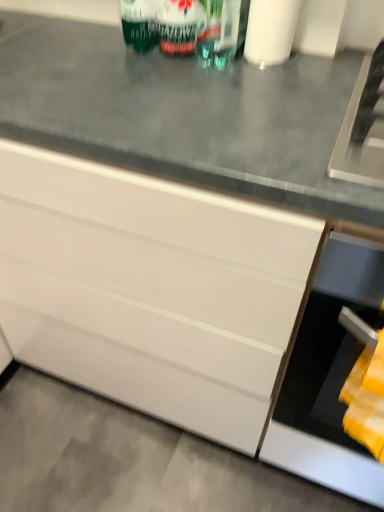
Find the location of a particular element. free spot above gray concrete floor at lower left (from a real-world perspective) is located at coordinates (128, 460).